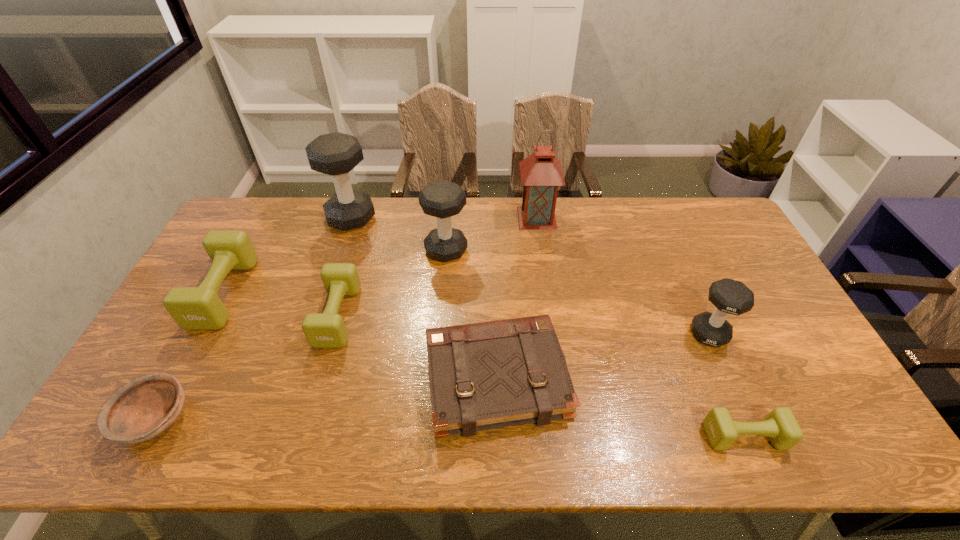
You are a GUI agent. You are given a task and a screenshot of the screen. Output one action in this format:
    pyautogui.click(x=<x>, y=<y>)
    Task: Click on the second olive dumbbell from left to right
    
    Given the screenshot: What is the action you would take?
    pyautogui.click(x=322, y=330)

Locate an element on the screen. Image resolution: width=960 pixels, height=540 pixels. hardback book is located at coordinates (488, 375).

In order to click on the nearest dumbbell in this screenshot , I will do `click(780, 425)`.

The image size is (960, 540). What are the coordinates of `the smallest olive dumbbell` in the screenshot? It's located at (780, 425).

The image size is (960, 540). I want to click on bowl, so click(x=142, y=409).

Find the location of a particular element. free location located on the left of the lantern is located at coordinates pyautogui.click(x=498, y=218).

You are a GUI agent. You are given a task and a screenshot of the screen. Output one action in this format:
    pyautogui.click(x=<x>, y=<y>)
    Task: Click on the free spot located on the right of the tallest dumbbell
    This screenshot has width=960, height=540.
    Given the screenshot: What is the action you would take?
    pyautogui.click(x=397, y=218)

This screenshot has height=540, width=960. What are the coordinates of `free space located 0.400m on the left of the second smallest gray dumbbell` in the screenshot? It's located at (306, 251).

Identify the location of free space located on the front of the nearest gray dumbbell. (759, 447).

At what (x,y) coordinates should I click in order to perform the action: click on free region located on the right of the fourth tallest dumbbell. Please return your answer as a coordinate pair (x, y). Looking at the image, I should click on (339, 293).